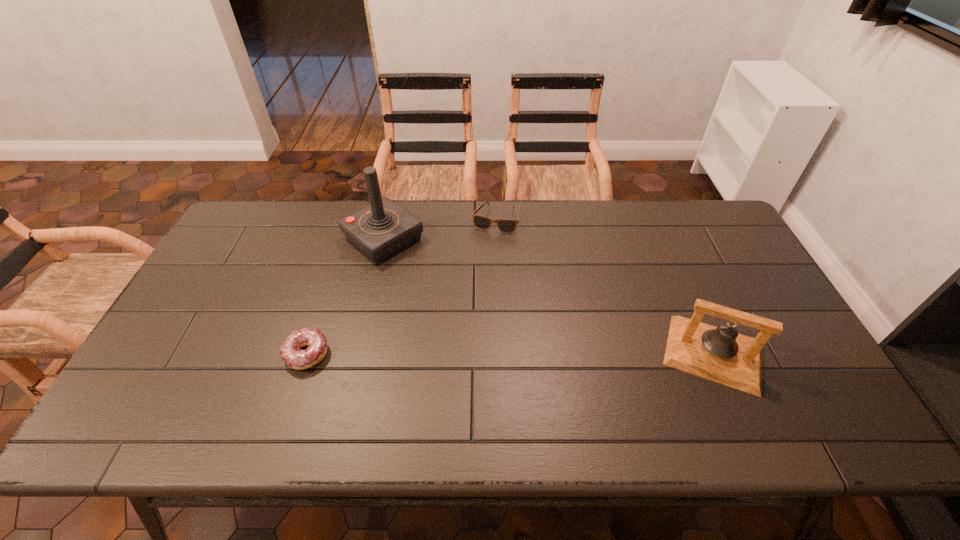
The width and height of the screenshot is (960, 540). What are the coordinates of `free spot located on the rectangular base of the joystick` in the screenshot? It's located at tap(462, 301).

Find the location of `free spot located 0.150m on the rectangular base of the joystick`. free spot located 0.150m on the rectangular base of the joystick is located at coordinates (441, 284).

Locate an element on the screen. free location located on the rectangular base of the joystick is located at coordinates (429, 275).

Where is `sunglasses positioned at the far edge`? This screenshot has height=540, width=960. sunglasses positioned at the far edge is located at coordinates (481, 222).

The image size is (960, 540). I want to click on joystick located in the far edge section of the desktop, so click(x=383, y=228).

The width and height of the screenshot is (960, 540). I want to click on doughnut positioned at the near edge, so click(x=297, y=359).

The width and height of the screenshot is (960, 540). Identify the location of bell located at the near edge. (720, 354).

The width and height of the screenshot is (960, 540). Identify the location of object situated at the right edge. (720, 354).

This screenshot has width=960, height=540. What are the coordinates of `object that is at the near right corner` in the screenshot? It's located at (720, 354).

At what (x,y) coordinates should I click in order to perform the action: click on vacant space at the far edge. Please return your answer as a coordinate pair (x, y). This screenshot has width=960, height=540. Looking at the image, I should click on (527, 211).